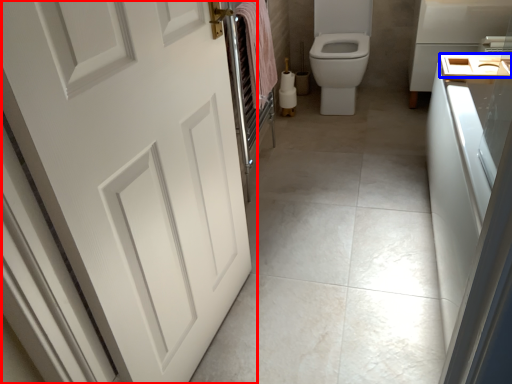
Question: Which point is closer to the camera, door (highlighted by a red box) or sink (highlighted by a blue box)?

Choices:
 (A) door
 (B) sink

Answer: (A)